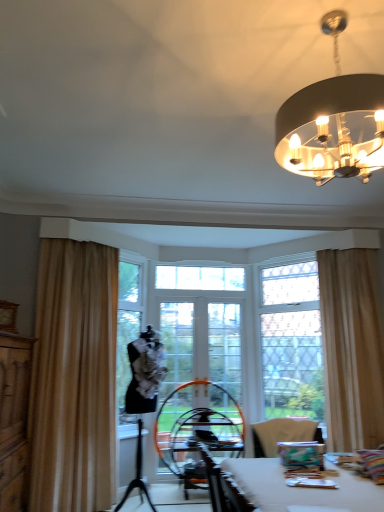
Image resolution: width=384 pixels, height=512 pixels. I want to click on empty space that is ontop of matte black chandelier at upper right, so [x=332, y=30].